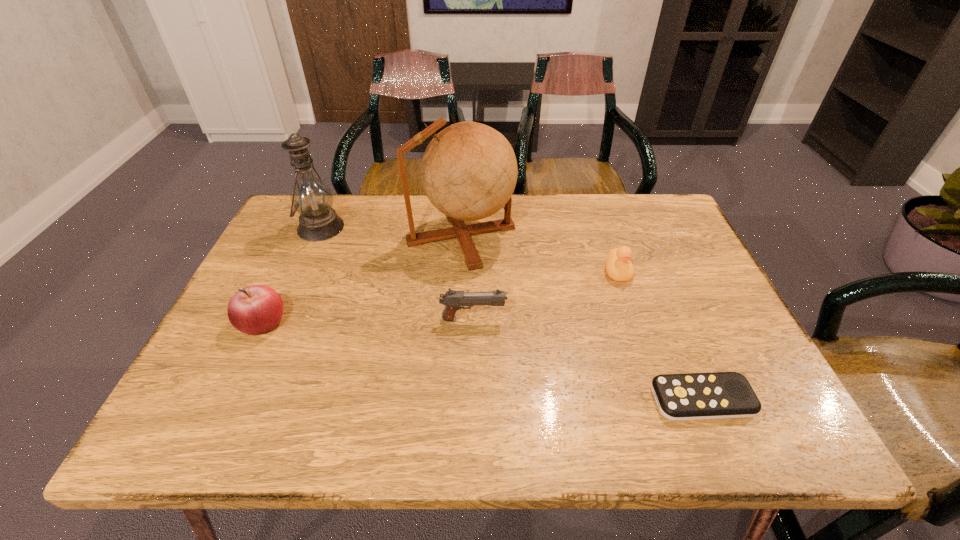
Locate an element on the screen. The height and width of the screenshot is (540, 960). object present at the near right corner is located at coordinates (716, 395).

Locate an element on the screen. free space at the far edge of the desktop is located at coordinates (504, 238).

Identify the location of vacant space at the near edge of the desktop. (486, 430).

In the image, there is a desktop. Where is `free space at the left edge`? This screenshot has width=960, height=540. free space at the left edge is located at coordinates (276, 351).

In the image, there is a desktop. Where is `vacant area at the right edge`? This screenshot has width=960, height=540. vacant area at the right edge is located at coordinates (729, 370).

Find the location of `unoccupied area between the oil lamp and the apple`. unoccupied area between the oil lamp and the apple is located at coordinates (292, 275).

This screenshot has width=960, height=540. I want to click on empty space between the shortest object and the apple, so click(x=482, y=361).

Identify the location of unoccupied area between the nearest object and the oil lamp. (512, 313).

I want to click on empty space that is in between the globe and the duck, so click(540, 253).

Locate an element on the screen. empty space that is in between the apple and the remote control is located at coordinates (482, 361).